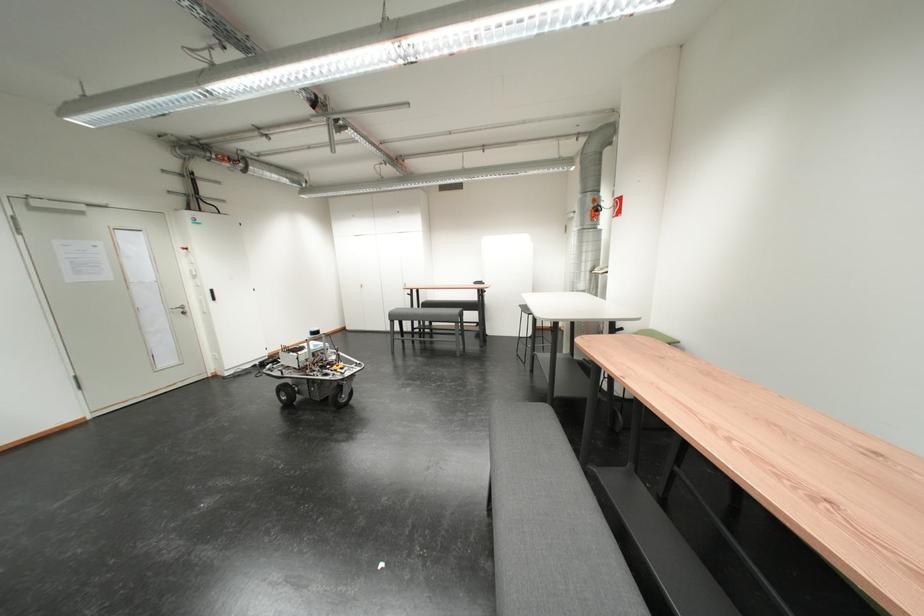
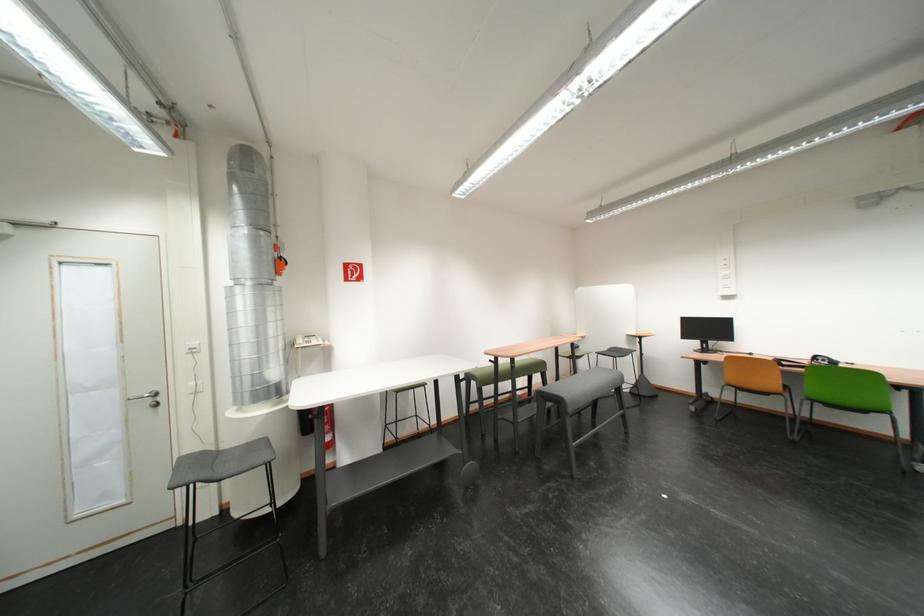
Locate, in the second image, the point that corresponds to (608,272) in the first image.

(311, 345)